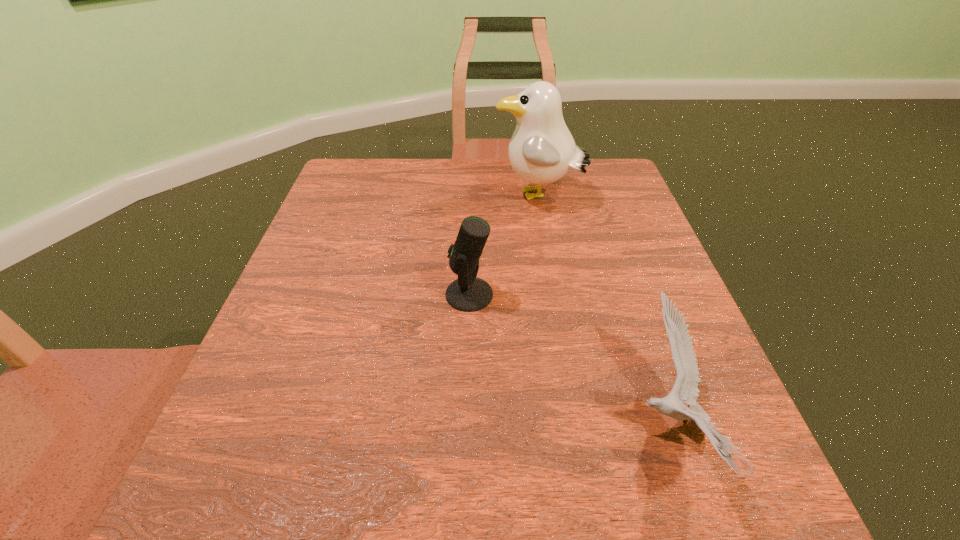
Find the location of `free spot between the farther gull and the leftmost object`. free spot between the farther gull and the leftmost object is located at coordinates (504, 246).

You are a GUI agent. You are given a task and a screenshot of the screen. Output one action in this format:
    pyautogui.click(x=<x>, y=<y>)
    Task: Click on the free space between the farther gull and the second farthest object
    The height and width of the screenshot is (540, 960).
    Given the screenshot: What is the action you would take?
    pyautogui.click(x=504, y=246)

Find the location of a particular element. The height and width of the screenshot is (540, 960). object that stands as the closest to the nearer gull is located at coordinates (468, 293).

Locate which object ranks second in proximity to the second nearest object. Please provide its 2D coordinates. Your answer should be formatted as a tuple, i.e. [(x, y)], where the tuple contains the x and y coordinates of a point satisfying the conditions above.

[(685, 390)]

I want to click on vacant point that satisfies the following two spatial constraints: 1. on the beak of the tallest object; 2. on the front side of the second farthest object, so click(555, 294).